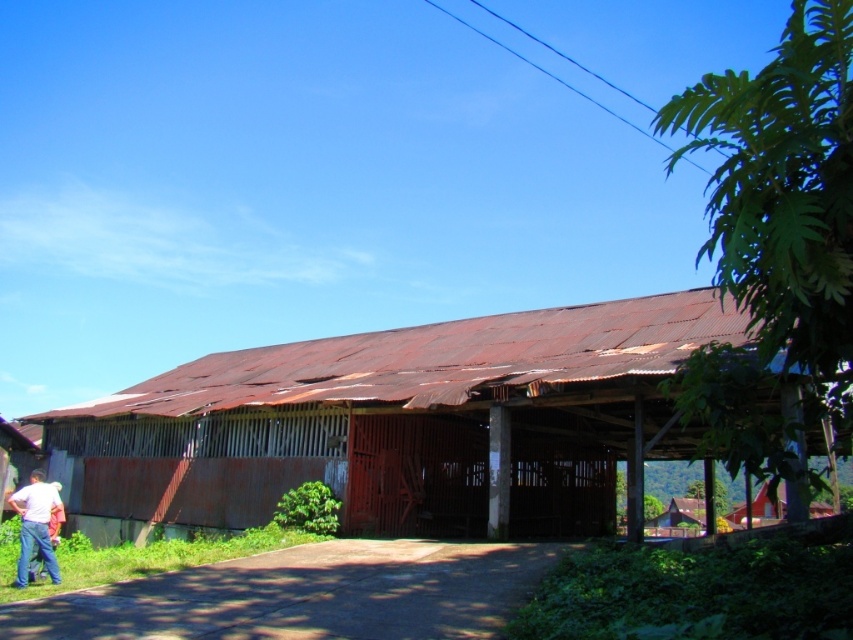
Question: Can you confirm if rusty corrugated metal barn at center is smaller than white matte shirt at lower left?

Choices:
 (A) no
 (B) yes

Answer: (A)

Question: Is rusty corrugated metal barn at center wider than white matte shirt at lower left?

Choices:
 (A) yes
 (B) no

Answer: (A)

Question: Which point is closer to the camera?

Choices:
 (A) (20, 531)
 (B) (254, 502)

Answer: (A)

Question: Is rusty corrugated metal barn at center wider than white matte shirt at lower left?

Choices:
 (A) no
 (B) yes

Answer: (B)